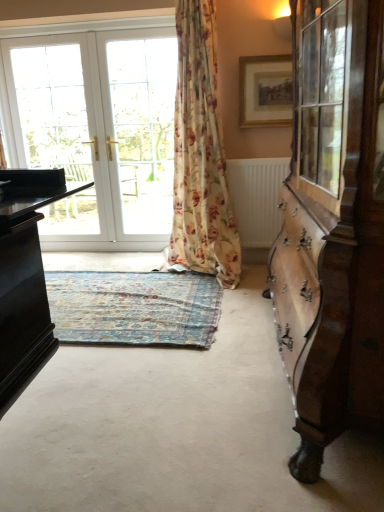
Question: Can you confirm if white glossy door at upper left is thinner than gold-framed picture at upper center?

Choices:
 (A) no
 (B) yes

Answer: (A)

Question: Is white glossy door at upper left far away from gold-framed picture at upper center?

Choices:
 (A) no
 (B) yes

Answer: (B)

Question: From the image's perspective, is white glossy door at upper left beneath gold-framed picture at upper center?

Choices:
 (A) no
 (B) yes

Answer: (B)

Question: Can you confirm if white glossy door at upper left is bigger than gold-framed picture at upper center?

Choices:
 (A) no
 (B) yes

Answer: (B)

Question: Does white glossy door at upper left turn towards gold-framed picture at upper center?

Choices:
 (A) yes
 (B) no

Answer: (B)

Question: Is white glossy door at upper left wider than gold-framed picture at upper center?

Choices:
 (A) no
 (B) yes

Answer: (B)

Question: Is white glass door at center closer to camera compared to white glossy door at upper left?

Choices:
 (A) no
 (B) yes

Answer: (B)

Question: Considering the relative sizes of white glass door at center and white glossy door at upper left in the image provided, is white glass door at center wider than white glossy door at upper left?

Choices:
 (A) yes
 (B) no

Answer: (A)

Question: Could white glossy door at upper left be considered to be inside white glass door at center?

Choices:
 (A) yes
 (B) no

Answer: (A)

Question: Is white glass door at center further to camera compared to white glossy door at upper left?

Choices:
 (A) no
 (B) yes

Answer: (A)

Question: Is white glass door at center at the left side of white glossy door at upper left?

Choices:
 (A) yes
 (B) no

Answer: (B)

Question: From a real-world perspective, is white glass door at center physically above white glossy door at upper left?

Choices:
 (A) no
 (B) yes

Answer: (B)

Question: Is floral fabric curtain at center wider than blue floral rug at center?

Choices:
 (A) no
 (B) yes

Answer: (A)